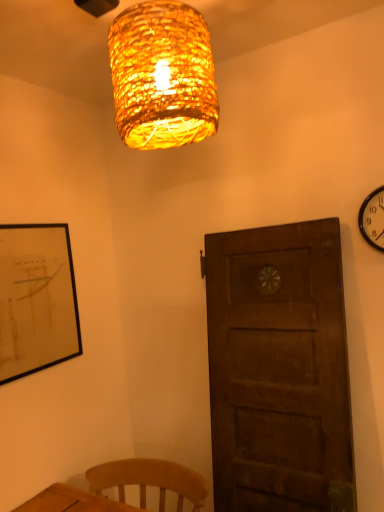
Question: Is the position of woven bamboo lampshade at upper center less distant than that of black metal wall clock at upper right?

Choices:
 (A) no
 (B) yes

Answer: (B)

Question: Could you tell me if woven bamboo lampshade at upper center is facing black metal wall clock at upper right?

Choices:
 (A) yes
 (B) no

Answer: (B)

Question: From a real-world perspective, is woven bamboo lampshade at upper center physically above black metal wall clock at upper right?

Choices:
 (A) no
 (B) yes

Answer: (B)

Question: Is black metal wall clock at upper right at the back of woven bamboo lampshade at upper center?

Choices:
 (A) no
 (B) yes

Answer: (A)

Question: From the image's perspective, is woven bamboo lampshade at upper center on black metal wall clock at upper right?

Choices:
 (A) yes
 (B) no

Answer: (A)

Question: Are woven bamboo lampshade at upper center and black metal wall clock at upper right far apart?

Choices:
 (A) no
 (B) yes

Answer: (A)

Question: Considering the relative sizes of black metal wall clock at upper right and woven bamboo lampshade at upper center in the image provided, is black metal wall clock at upper right smaller than woven bamboo lampshade at upper center?

Choices:
 (A) yes
 (B) no

Answer: (A)

Question: Is woven bamboo lampshade at upper center completely or partially inside black metal wall clock at upper right?

Choices:
 (A) yes
 (B) no

Answer: (B)

Question: Is black metal wall clock at upper right wider than woven bamboo lampshade at upper center?

Choices:
 (A) yes
 (B) no

Answer: (B)

Question: From the image's perspective, is black metal wall clock at upper right above woven bamboo lampshade at upper center?

Choices:
 (A) yes
 (B) no

Answer: (B)

Question: Can you confirm if black metal wall clock at upper right is positioned to the left of woven bamboo lampshade at upper center?

Choices:
 (A) no
 (B) yes

Answer: (A)

Question: From a real-world perspective, is black metal wall clock at upper right under woven bamboo lampshade at upper center?

Choices:
 (A) no
 (B) yes

Answer: (B)

Question: From a real-world perspective, relative to woven bamboo lampshade at upper center, is black metal wall clock at upper right vertically above or below?

Choices:
 (A) below
 (B) above

Answer: (A)